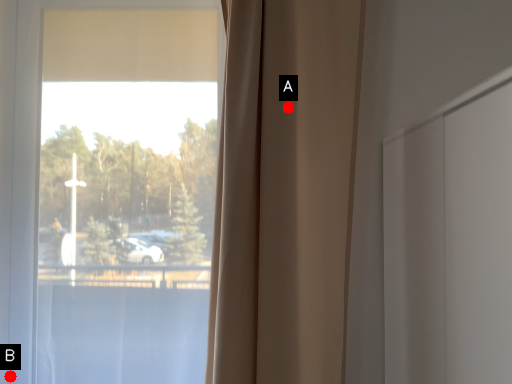
Question: Two points are circled on the image, labeled by A and B beside each circle. Among these points, which one is farthest from the camera?

Choices:
 (A) A is further
 (B) B is further

Answer: (B)